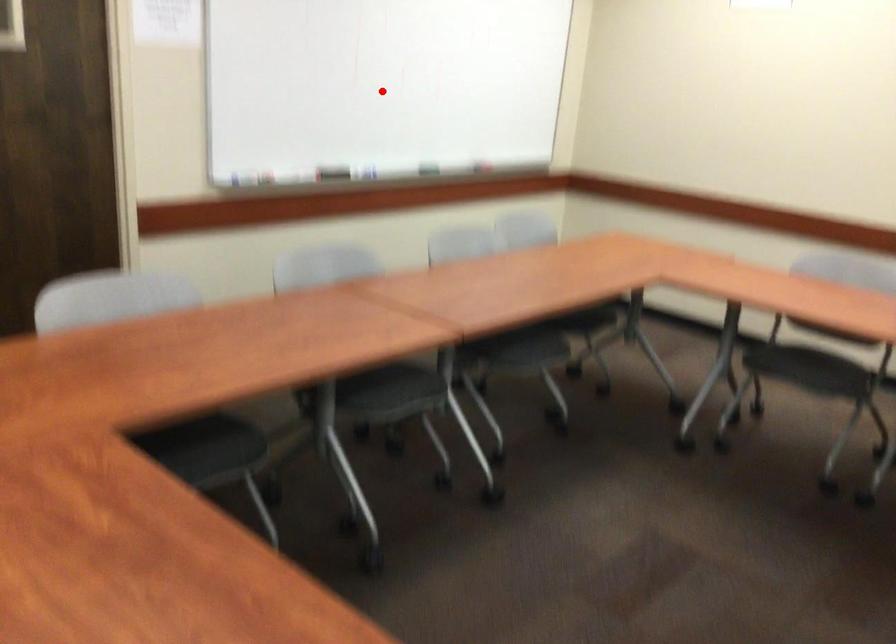
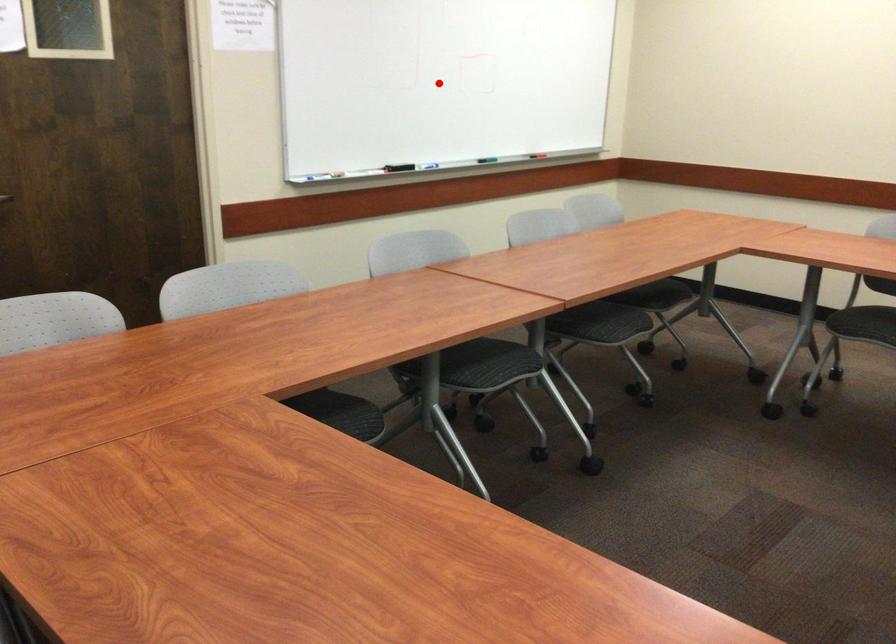
I am providing you with two images of the same scene from different viewpoints. A red point is marked on the first image and another point is marked on the second image. Do the highlighted points in image1 and image2 indicate the same real-world spot?

No